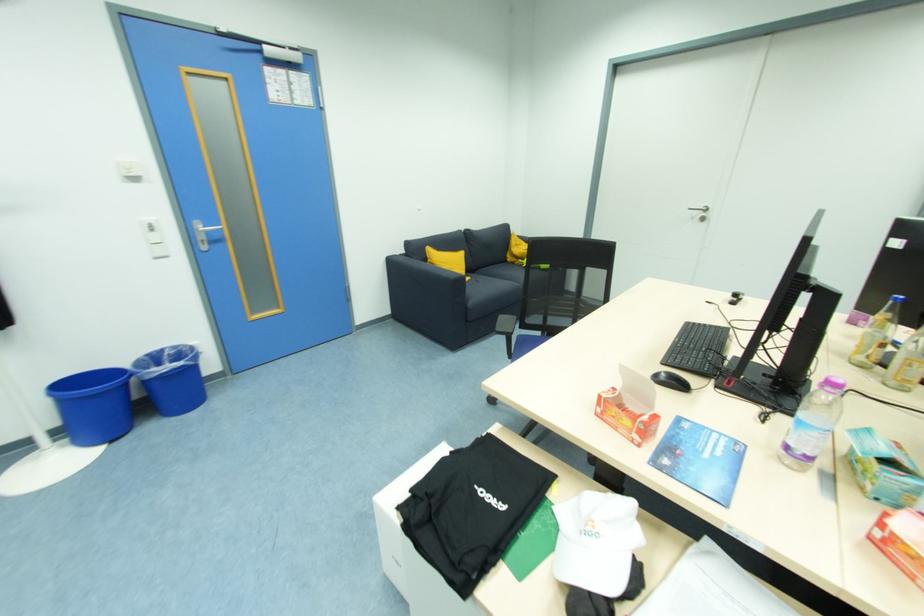
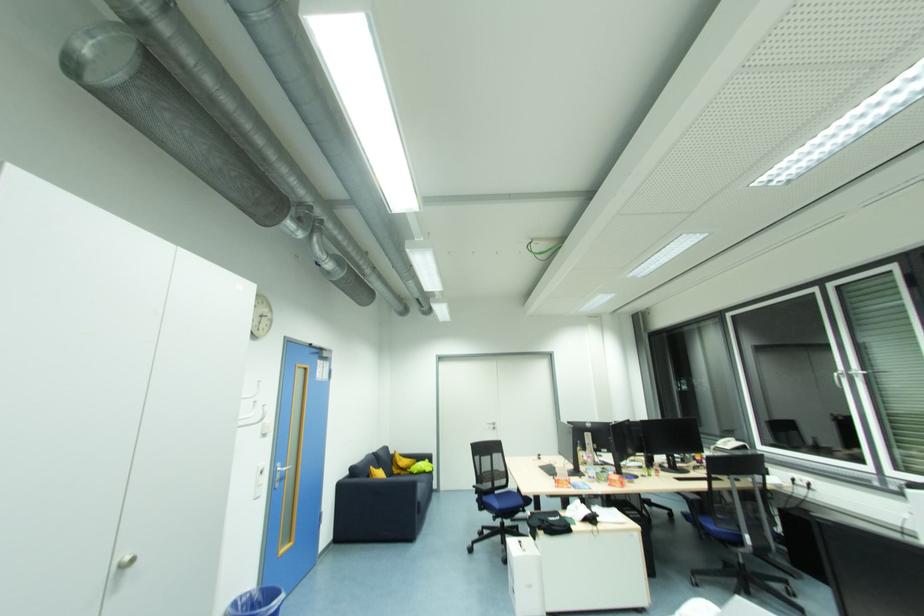
The point at (512, 261) is marked in the first image. Where is the corresponding point in the second image?

(398, 472)